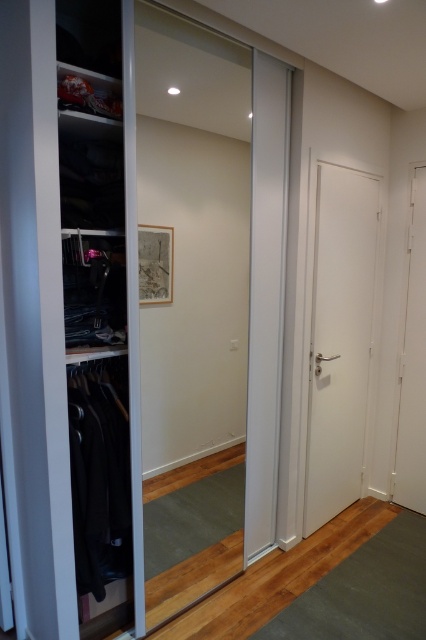
Question: Is transparent glass door at center closer to camera compared to white smooth door at right?

Choices:
 (A) yes
 (B) no

Answer: (A)

Question: Which point is closer to the camera?

Choices:
 (A) white matte door at right
 (B) white smooth door at right
 (C) transparent glass door at center

Answer: (C)

Question: Which of the following is the farthest from the observer?

Choices:
 (A) (408, 388)
 (B) (353, 332)
 (C) (181, 26)

Answer: (A)

Question: Can you confirm if white smooth door at right is positioned above white matte door at right?

Choices:
 (A) no
 (B) yes

Answer: (A)

Question: Which object is the farthest from the white smooth door at right?

Choices:
 (A) transparent glass door at center
 (B) white matte door at right

Answer: (A)

Question: Can you confirm if transparent glass door at center is positioned above white smooth door at right?

Choices:
 (A) yes
 (B) no

Answer: (A)